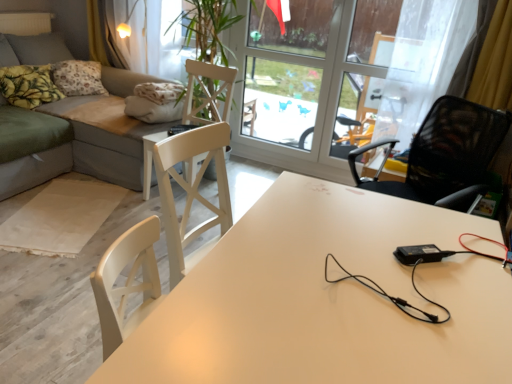
Question: Are transparent glass window at upper center and transparent glass screen door at upper center located far from each other?

Choices:
 (A) yes
 (B) no

Answer: (B)

Question: Considering the relative sizes of transparent glass window at upper center and transparent glass screen door at upper center in the image provided, is transparent glass window at upper center smaller than transparent glass screen door at upper center?

Choices:
 (A) yes
 (B) no

Answer: (A)

Question: Is transparent glass window at upper center further to the viewer compared to transparent glass screen door at upper center?

Choices:
 (A) no
 (B) yes

Answer: (B)

Question: Is transparent glass window at upper center thinner than transparent glass screen door at upper center?

Choices:
 (A) yes
 (B) no

Answer: (A)

Question: Considering the relative positions of transparent glass window at upper center and transparent glass screen door at upper center in the image provided, is transparent glass window at upper center in front of transparent glass screen door at upper center?

Choices:
 (A) yes
 (B) no

Answer: (B)

Question: Considering the relative positions of transparent glass window at upper center and transparent glass screen door at upper center in the image provided, is transparent glass window at upper center to the right of transparent glass screen door at upper center from the viewer's perspective?

Choices:
 (A) yes
 (B) no

Answer: (A)

Question: Considering the relative positions of transparent glass window at upper center and white glossy table at center in the image provided, is transparent glass window at upper center behind white glossy table at center?

Choices:
 (A) yes
 (B) no

Answer: (A)

Question: Is transparent glass window at upper center to the left of white glossy table at center from the viewer's perspective?

Choices:
 (A) yes
 (B) no

Answer: (A)

Question: Is transparent glass window at upper center not within white glossy table at center?

Choices:
 (A) no
 (B) yes

Answer: (B)

Question: From a real-world perspective, is transparent glass window at upper center under white glossy table at center?

Choices:
 (A) yes
 (B) no

Answer: (B)

Question: From the image's perspective, is transparent glass window at upper center over white glossy table at center?

Choices:
 (A) yes
 (B) no

Answer: (A)

Question: Is transparent glass window at upper center aimed at white glossy table at center?

Choices:
 (A) yes
 (B) no

Answer: (B)

Question: Can you confirm if yellow printed fabric pillow at upper left, the second pillow when ordered from back to front, is taller than yellow printed fabric pillow at upper left, which appears as the second pillow when viewed from the front?

Choices:
 (A) no
 (B) yes

Answer: (A)